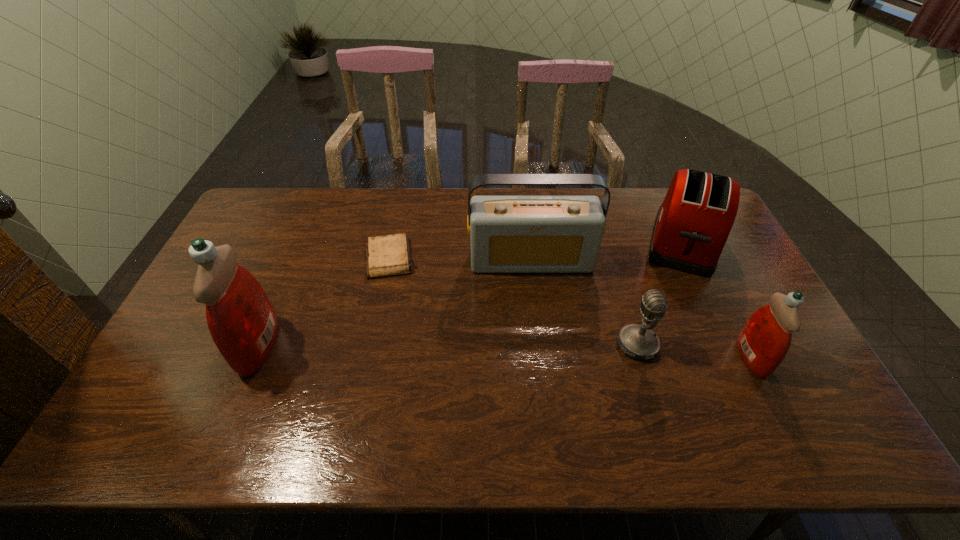
To make them evenly spaced by inserting another detergent among them, please locate a free space for this new detergent. Please provide its 2D coordinates. Your answer should be formatted as a tuple, i.e. [(x, y)], where the tuple contains the x and y coordinates of a point satisfying the conditions above.

[(502, 351)]